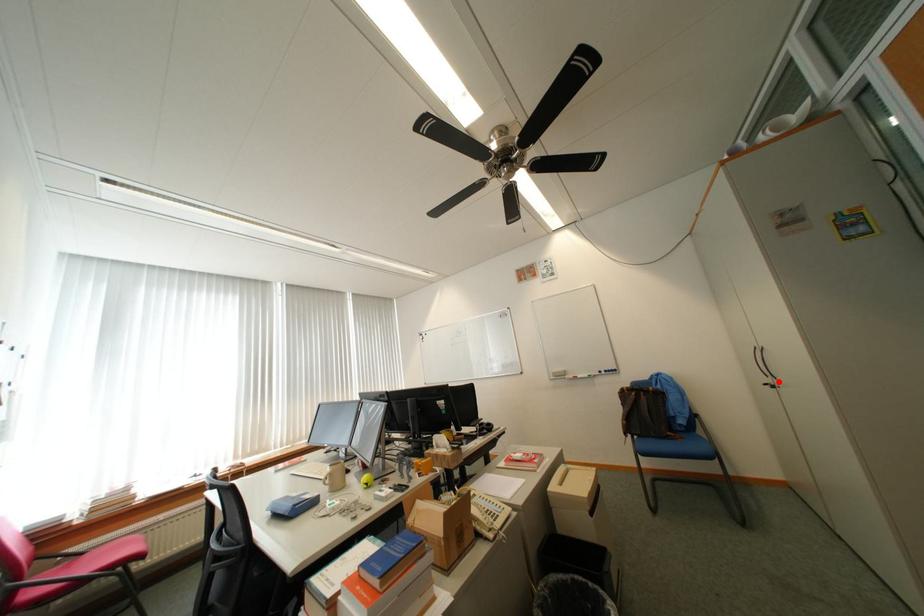
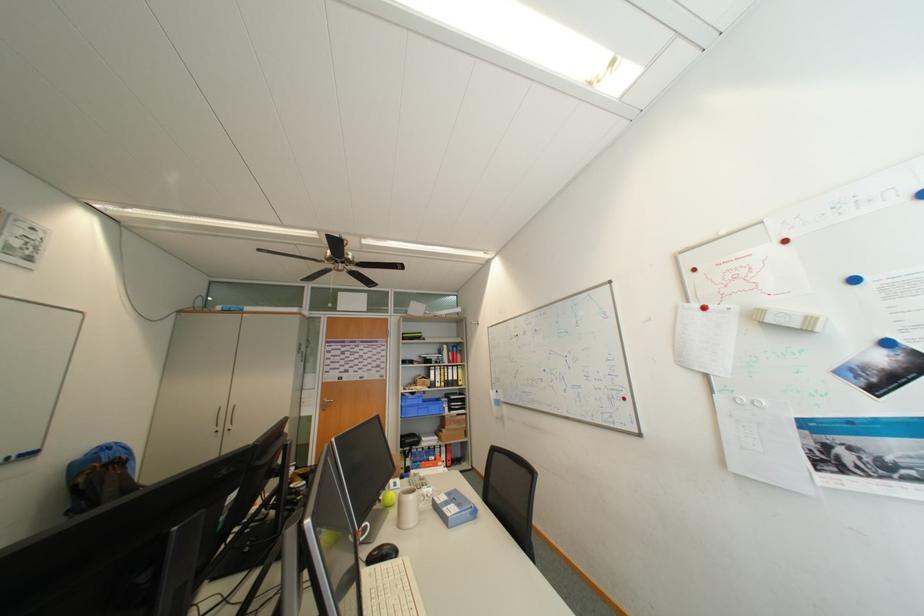
In the second image, find the point that corresponds to the highlighted location in the first image.

(229, 429)